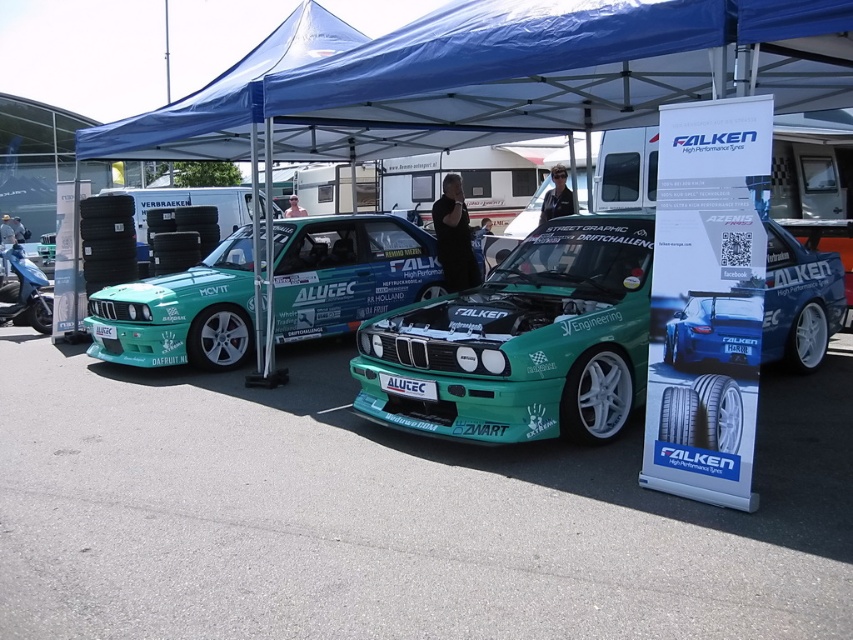
You are a photographer at the car event. You need to position a large camera rig between the green matte car at center and the teal matte car at center. Given that the rig requires 5 meters of space, will there be enough room between them?

The green matte car at center occupies less space than teal matte car at center. However, the description does not provide specific measurements of the distance between them, so we cannot determine if the 5 meters required for the camera rig is available.

You are standing at the car event and want to take a photo of the two points marked in the image. Which point, point 1 at coordinates (x=779, y=298) or point 2 at coordinates (x=21, y=294), appears closer to you in the photo?

Point 1 at coordinates (x=779, y=298) appears closer to you because it is closer to the viewer than point 2 at coordinates (x=21, y=294).

You are a photographer standing at the entrance of the event. You want to take a photo of the blue glossy car at center and the blue metallic scooter at left so that both are fully visible in the frame. Based on their positions, which object should you focus on first to ensure both are in focus?

The blue glossy car at center is in front of the blue metallic scooter at left, so you should focus on the blue glossy car at center first to ensure both are in focus.